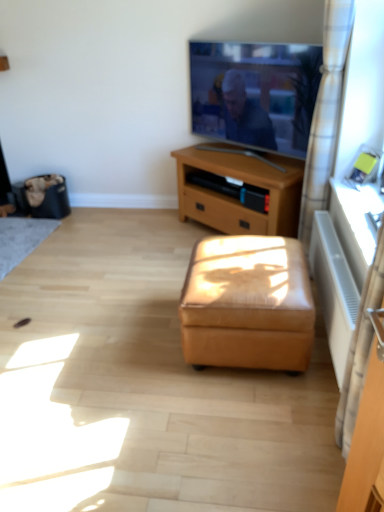
Question: From the image's perspective, is black fabric trash bin at left above or below leather ottoman at center?

Choices:
 (A) above
 (B) below

Answer: (A)

Question: Is black fabric trash bin at left in front of or behind leather ottoman at center in the image?

Choices:
 (A) front
 (B) behind

Answer: (B)

Question: Which is nearer to the matte black tv at upper center?

Choices:
 (A) metallic silver radiator at right
 (B) brown wooden tv stand at center
 (C) black fabric trash bin at left
 (D) leather ottoman at center
 (E) white checkered curtain at right

Answer: (B)

Question: Estimate the real-world distances between objects in this image. Which object is closer to the black fabric trash bin at left?

Choices:
 (A) white checkered curtain at right
 (B) metallic silver radiator at right
 (C) matte black tv at upper center
 (D) leather ottoman at center
 (E) brown wooden tv stand at center

Answer: (E)